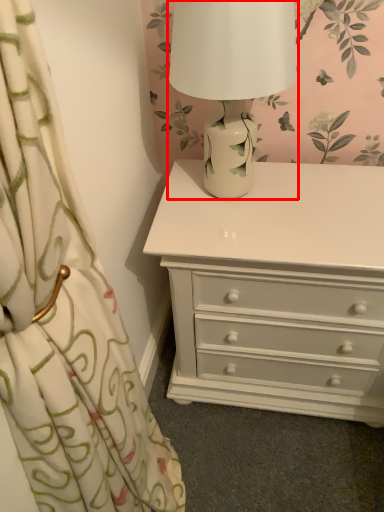
Question: Observing the image, what is the correct spatial positioning of table lamp (annotated by the red box) in reference to chest of drawers?

Choices:
 (A) left
 (B) right

Answer: (A)